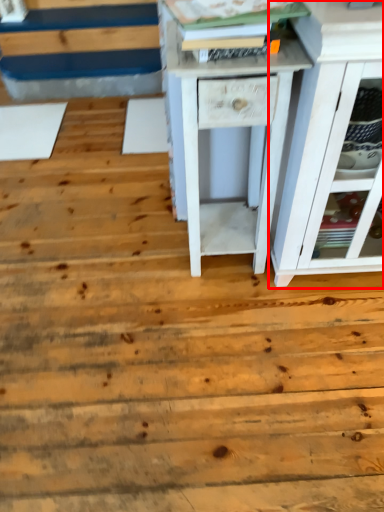
Question: From the image's perspective, what is the correct spatial positioning of chest of drawers (annotated by the red box) in reference to nightstand?

Choices:
 (A) below
 (B) above

Answer: (B)